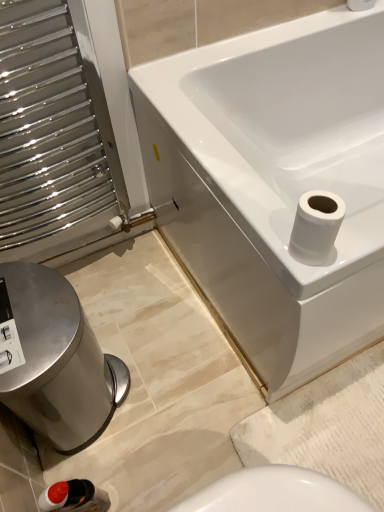
Question: From a real-world perspective, is white glossy bathtub at upper right physically above white glossy toilet paper at upper right, the second toilet paper viewed from the back?

Choices:
 (A) yes
 (B) no

Answer: (B)

Question: Is white glossy bathtub at upper right looking in the opposite direction of white glossy toilet paper at upper right, the second toilet paper viewed from the back?

Choices:
 (A) no
 (B) yes

Answer: (A)

Question: Is white glossy bathtub at upper right shorter than white glossy toilet paper at upper right, which is counted as the first toilet paper, starting from the left?

Choices:
 (A) no
 (B) yes

Answer: (A)

Question: Does white glossy bathtub at upper right contain white glossy toilet paper at upper right, which is counted as the first toilet paper, starting from the left?

Choices:
 (A) no
 (B) yes

Answer: (A)

Question: Is white glossy bathtub at upper right thinner than white glossy toilet paper at upper right, the 1th toilet paper from the front?

Choices:
 (A) no
 (B) yes

Answer: (A)

Question: Does white glossy bathtub at upper right appear on the right side of white glossy toilet paper at upper right, the first toilet paper when ordered from bottom to top?

Choices:
 (A) yes
 (B) no

Answer: (A)

Question: Considering the relative sizes of polished stainless steel bidet at lower left and white glossy bathtub at upper right in the image provided, is polished stainless steel bidet at lower left smaller than white glossy bathtub at upper right?

Choices:
 (A) no
 (B) yes

Answer: (B)

Question: Considering the relative sizes of polished stainless steel bidet at lower left and white glossy bathtub at upper right in the image provided, is polished stainless steel bidet at lower left taller than white glossy bathtub at upper right?

Choices:
 (A) no
 (B) yes

Answer: (A)

Question: From a real-world perspective, does polished stainless steel bidet at lower left stand above white glossy bathtub at upper right?

Choices:
 (A) yes
 (B) no

Answer: (B)

Question: Does polished stainless steel bidet at lower left appear on the right side of white glossy bathtub at upper right?

Choices:
 (A) no
 (B) yes

Answer: (A)

Question: From the image's perspective, is polished stainless steel bidet at lower left on white glossy bathtub at upper right?

Choices:
 (A) no
 (B) yes

Answer: (A)

Question: Is white glossy bathtub at upper right surrounded by polished stainless steel bidet at lower left?

Choices:
 (A) yes
 (B) no

Answer: (B)

Question: Is white matte toilet paper at upper right, which is the first toilet paper from back to front, surrounding white glossy bathtub at upper right?

Choices:
 (A) no
 (B) yes

Answer: (A)